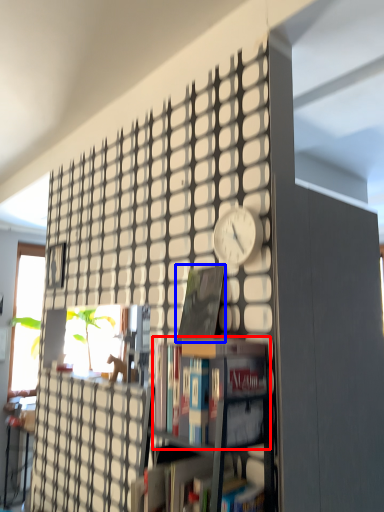
Question: Which point is further to the camera, book (highlighted by a red box) or book (highlighted by a blue box)?

Choices:
 (A) book
 (B) book

Answer: (B)